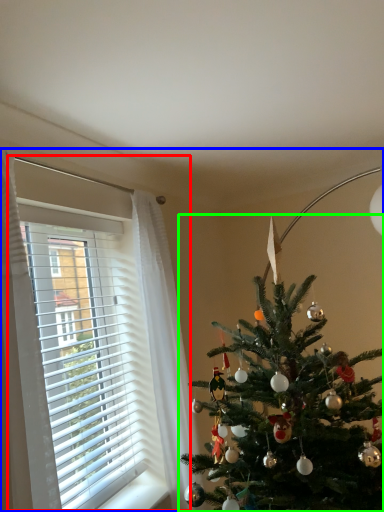
Question: Which is farther away from window (highlighted by a red box)? christmas eve (highlighted by a blue box) or christmas tree (highlighted by a green box)?

Choices:
 (A) christmas eve
 (B) christmas tree

Answer: (A)